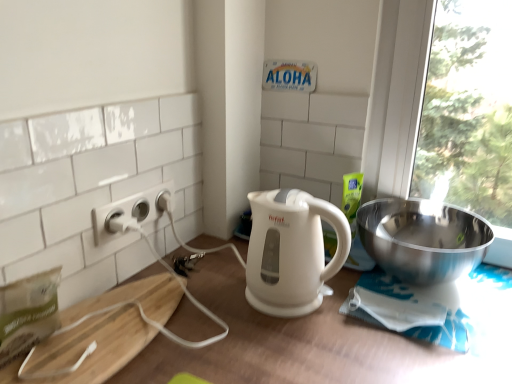
Identify the location of free space in front of white glossy electric kettle at center. The image size is (512, 384). (304, 351).